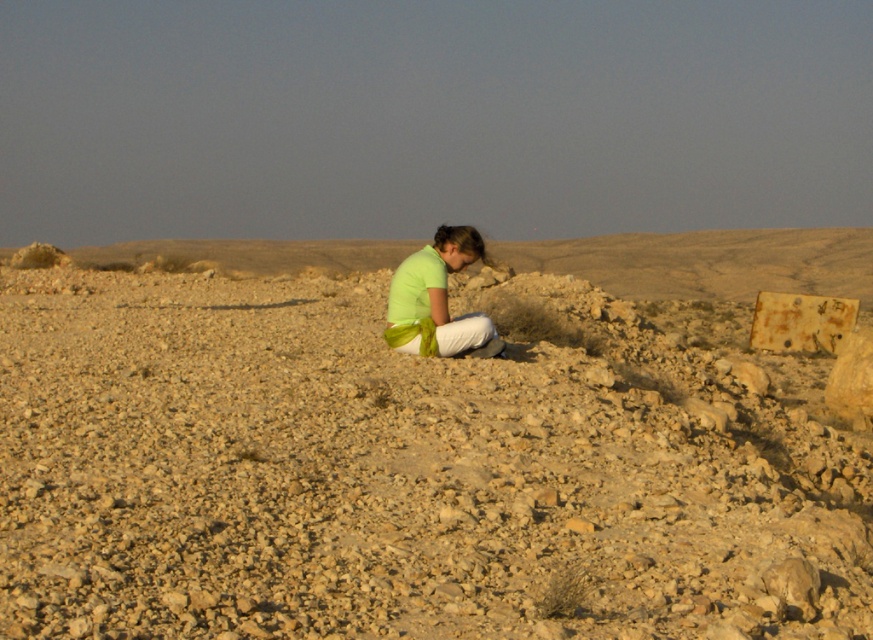
Question: Among these points, which one is farthest from the camera?

Choices:
 (A) (430, 337)
 (B) (674, 408)

Answer: (A)

Question: Does brown rocky dirt at center appear on the left side of green matte shirt at center?

Choices:
 (A) no
 (B) yes

Answer: (B)

Question: Which of the following is the closest to the observer?

Choices:
 (A) brown rocky dirt at center
 (B) green matte shirt at center

Answer: (A)

Question: Observing the image, what is the correct spatial positioning of brown rocky dirt at center in reference to green matte shirt at center?

Choices:
 (A) below
 (B) above

Answer: (B)

Question: Can you confirm if brown rocky dirt at center is positioned to the right of green matte shirt at center?

Choices:
 (A) no
 (B) yes

Answer: (A)